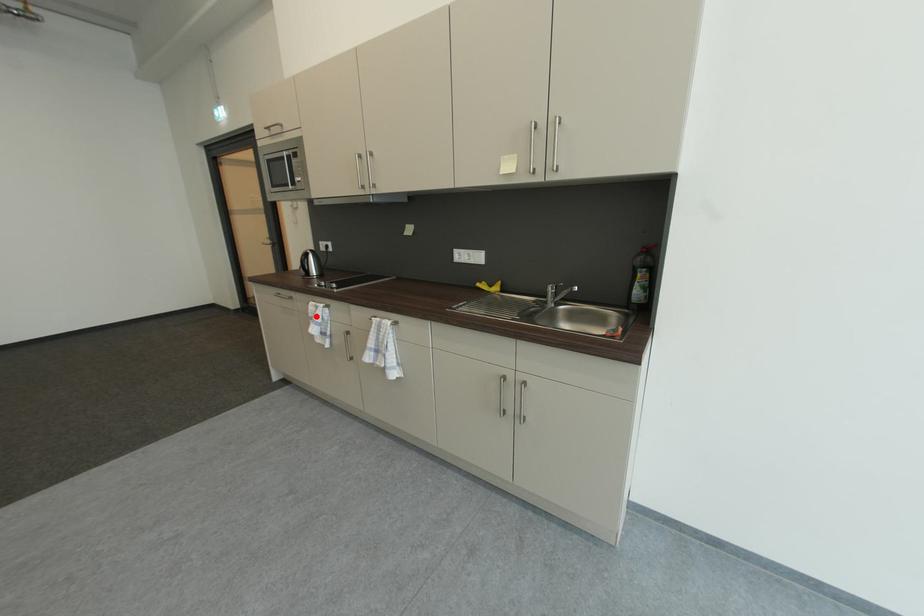
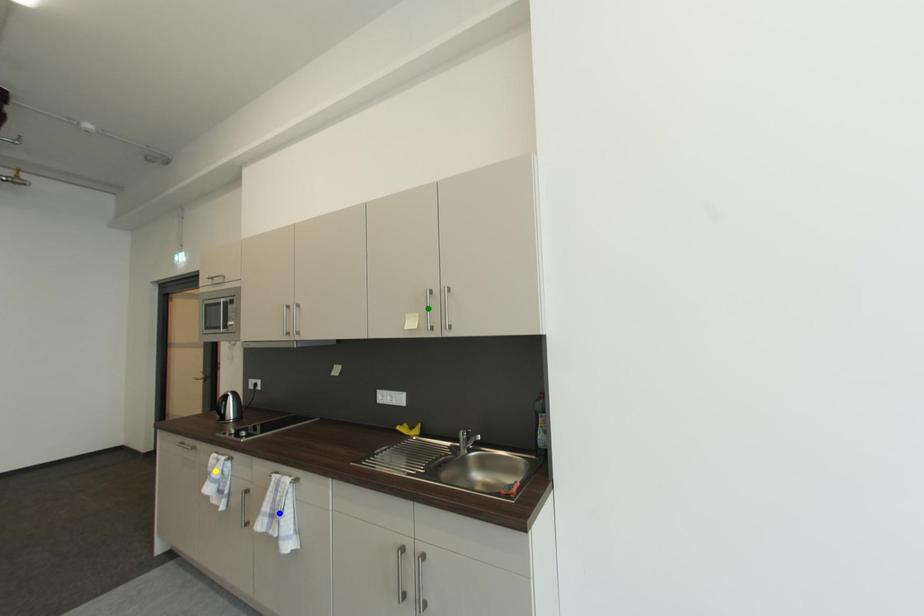
Question: I am providing you with two images of the same scene from different viewpoints. A red point is marked on the first image. You are given multiple points on the second image. Can you choose the point in image 2 that corresponds to the point in image 1?

Choices:
 (A) blue point
 (B) green point
 (C) yellow point

Answer: (C)